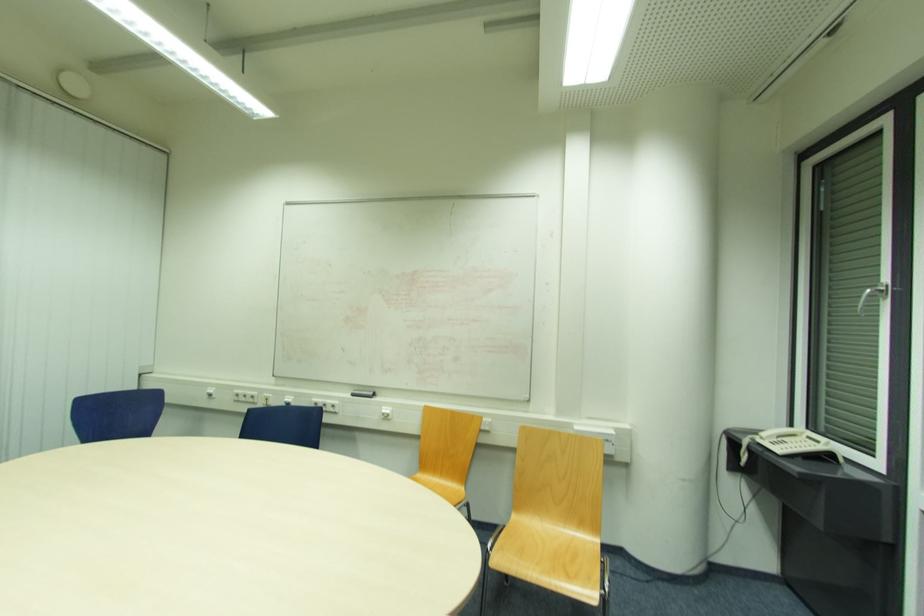
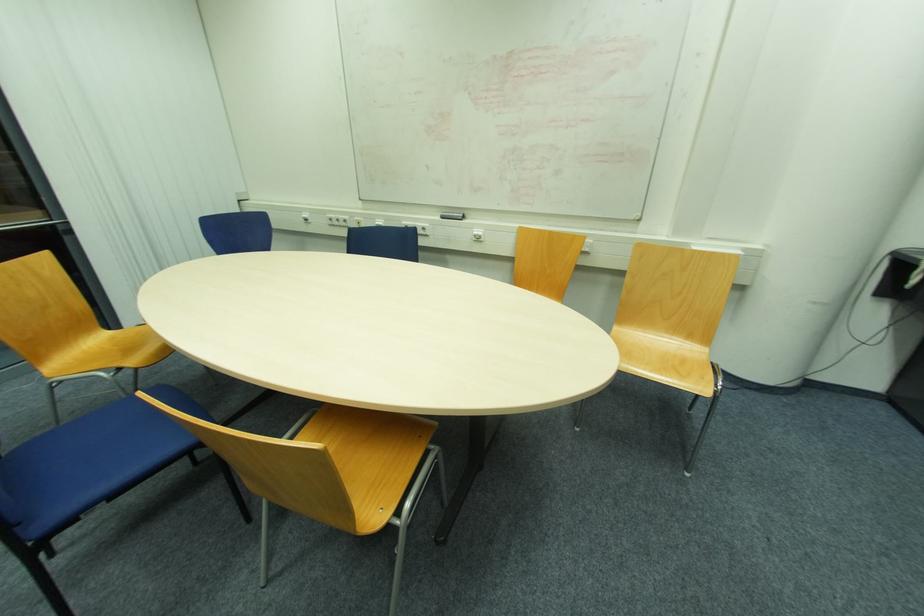
Find the pixel in the second image that matches point 385,411 in the first image.

(477, 233)